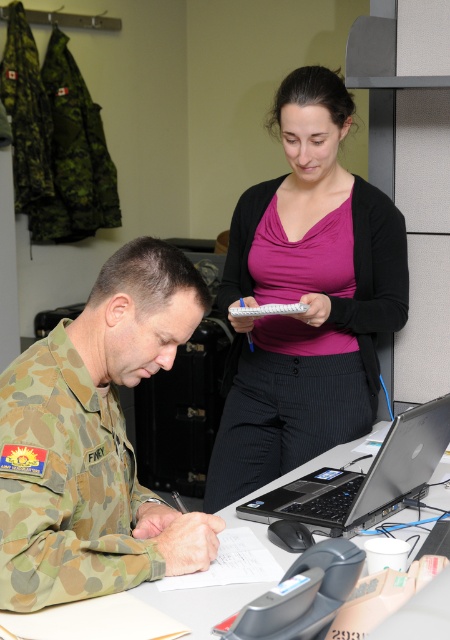
From the picture: You are a photographer adjusting your camera to focus on two specific points in the scene. Point A is at coordinates point [70,584] and Point B is at point [244,515]. Which point should you focus on first if you want to ensure both points are in sharp focus?

You should focus on point [70,584] first because it is closer to the camera than point [244,515]. By focusing on the closer point, the farther point will also be in focus due to the depth of field.

You are standing in front of the scene and want to know which of the two points, point (99, 333) or point (415, 627), is closer to you. Can you determine this based on their positions?

Point (99, 333) is further to the camera than point (415, 627), so the closer point to you is point (415, 627).